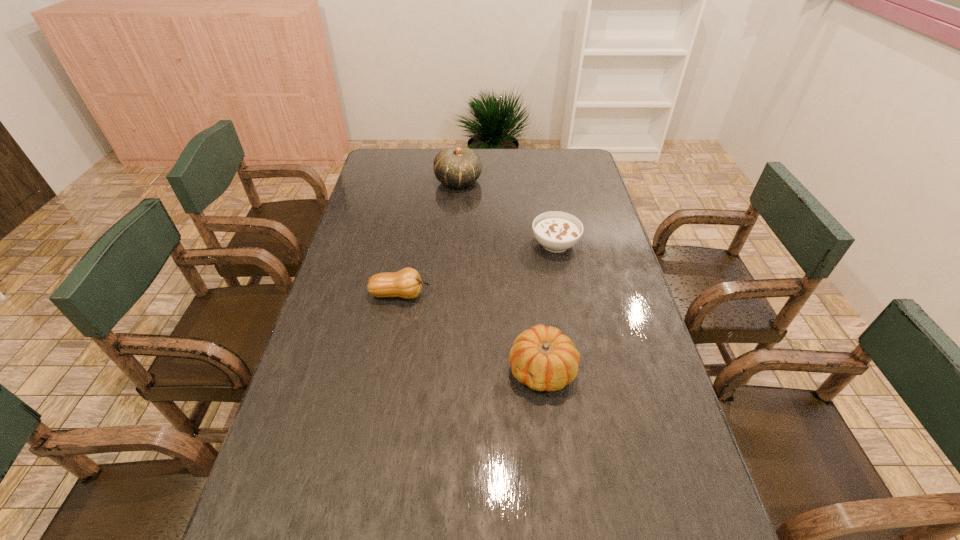
You are a GUI agent. You are given a task and a screenshot of the screen. Output one action in this format:
    pyautogui.click(x=<x>, y=<y>)
    Task: Click on the third closest object relative to the farthest object
    
    Given the screenshot: What is the action you would take?
    pyautogui.click(x=544, y=359)

Locate an element on the screen. This screenshot has height=540, width=960. gourd that can be found as the closest to the nearest gourd is located at coordinates (406, 283).

Find the location of a particular element. This screenshot has height=540, width=960. gourd that stands as the closest to the second farthest gourd is located at coordinates click(x=544, y=359).

Locate an element on the screen. The height and width of the screenshot is (540, 960). vacant area that satisfies the following two spatial constraints: 1. on the front side of the farthest gourd; 2. on the stem side of the third tallest object is located at coordinates click(451, 294).

Locate an element on the screen. The width and height of the screenshot is (960, 540). free space that satisfies the following two spatial constraints: 1. on the front side of the farthest gourd; 2. on the right side of the nearest gourd is located at coordinates (446, 369).

The width and height of the screenshot is (960, 540). Identify the location of free space that satisfies the following two spatial constraints: 1. on the stem side of the second nearest gourd; 2. on the right side of the rightmost gourd. (387, 369).

I want to click on free space that satisfies the following two spatial constraints: 1. on the front side of the tallest object; 2. on the stem side of the second nearest object, so click(451, 294).